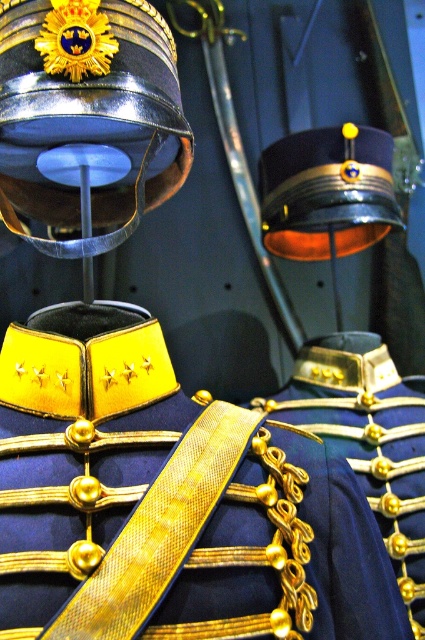
Question: Observing the image, what is the correct spatial positioning of metallic gold helmet at upper center in reference to gold metallic chain at center?

Choices:
 (A) left
 (B) right

Answer: (A)

Question: Where is metallic gold helmet at upper center located in relation to shiny black helmet at upper center in the image?

Choices:
 (A) above
 (B) below

Answer: (B)

Question: Among these objects, which one is nearest to the camera?

Choices:
 (A) metallic gold helmet at upper center
 (B) gold metallic chain at center
 (C) navy blue fabric with gold trim at center

Answer: (C)

Question: Which of the following is the closest to the observer?

Choices:
 (A) metallic gold helmet at upper center
 (B) gold metallic chain at center
 (C) shiny black helmet at upper center
 (D) navy blue fabric with gold trim at center

Answer: (D)

Question: Which object is the closest to the gold metallic chain at center?

Choices:
 (A) shiny black helmet at upper center
 (B) metallic gold helmet at upper center

Answer: (A)

Question: Is metallic gold helmet at upper center positioned behind shiny black helmet at upper center?

Choices:
 (A) yes
 (B) no

Answer: (B)